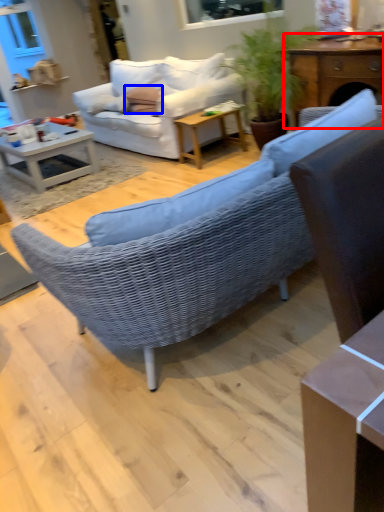
Question: Which point is closer to the camera, table (highlighted by a red box) or pillow (highlighted by a blue box)?

Choices:
 (A) table
 (B) pillow

Answer: (A)